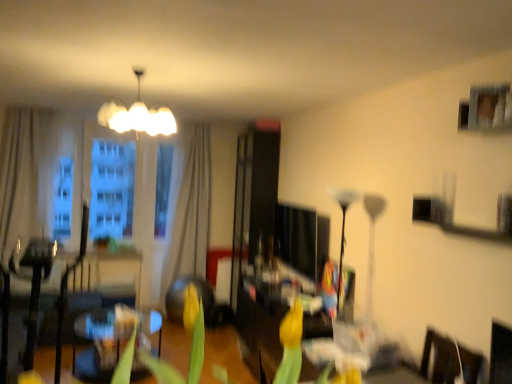
Question: Visually, is white fabric curtain at center, the 2th curtain positioned from the front, positioned to the left or to the right of black glass floor lamp at center, placed as the 1th lamp when sorted from bottom to top?

Choices:
 (A) right
 (B) left

Answer: (B)

Question: From a real-world perspective, relative to black glass floor lamp at center, which is the 2th lamp in top-to-bottom order, is white fabric curtain at center, the 2th curtain positioned from the front, vertically above or below?

Choices:
 (A) above
 (B) below

Answer: (A)

Question: Considering the real-world distances, which object is farthest from the black glass floor lamp at center, which is the 1th lamp in right-to-left order?

Choices:
 (A) white fabric curtain at center, the second curtain viewed from the left
 (B) dark brown leather armchair at left
 (C) white glossy chandelier at upper center, which appears as the 2th lamp when ordered from the bottom
 (D) beige fabric curtain at left, acting as the 1th curtain starting from the left
 (E) yellow matte tulip at center

Answer: (D)

Question: Which object is the farthest from the black glass floor lamp at center, which is the 2th lamp in top-to-bottom order?

Choices:
 (A) white glossy chandelier at upper center, which appears as the 2th lamp when ordered from the bottom
 (B) dark brown leather armchair at left
 (C) yellow matte tulip at center
 (D) beige fabric curtain at left, the 1th curtain from the front
 (E) white fabric curtain at center, the second curtain viewed from the left

Answer: (D)